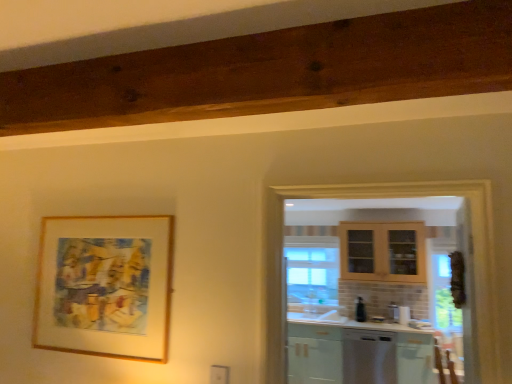
Question: Does black glossy soap dispenser at center have a lesser height compared to wooden frame at upper left?

Choices:
 (A) yes
 (B) no

Answer: (A)

Question: From the image's perspective, is black glossy soap dispenser at center over wooden frame at upper left?

Choices:
 (A) yes
 (B) no

Answer: (B)

Question: Is black glossy soap dispenser at center far away from wooden frame at upper left?

Choices:
 (A) yes
 (B) no

Answer: (A)

Question: From a real-world perspective, is black glossy soap dispenser at center under wooden frame at upper left?

Choices:
 (A) yes
 (B) no

Answer: (A)

Question: Is black glossy soap dispenser at center behind wooden frame at upper left?

Choices:
 (A) no
 (B) yes

Answer: (B)

Question: From a real-world perspective, is black glossy soap dispenser at center above or below wooden frame at upper left?

Choices:
 (A) above
 (B) below

Answer: (B)

Question: Is black glossy soap dispenser at center bigger or smaller than wooden frame at upper left?

Choices:
 (A) small
 (B) big

Answer: (A)

Question: From the image's perspective, is black glossy soap dispenser at center above or below wooden frame at upper left?

Choices:
 (A) below
 (B) above

Answer: (A)

Question: Would you say black glossy soap dispenser at center is inside or outside wooden frame at upper left?

Choices:
 (A) inside
 (B) outside

Answer: (B)

Question: Considering the positions of point coord(387,349) and point coord(354,311), is point coord(387,349) closer or farther from the camera than point coord(354,311)?

Choices:
 (A) closer
 (B) farther

Answer: (A)

Question: Is satin white dishwasher at lower right wider or thinner than black glossy soap dispenser at center?

Choices:
 (A) thin
 (B) wide

Answer: (B)

Question: Is satin white dishwasher at lower right inside the boundaries of black glossy soap dispenser at center, or outside?

Choices:
 (A) outside
 (B) inside

Answer: (A)

Question: From a real-world perspective, relative to black glossy soap dispenser at center, is satin white dishwasher at lower right vertically above or below?

Choices:
 (A) above
 (B) below

Answer: (B)

Question: Visually, is wooden frame at upper left positioned to the left or to the right of black glossy soap dispenser at center?

Choices:
 (A) left
 (B) right

Answer: (A)

Question: From the image's perspective, is wooden frame at upper left above or below black glossy soap dispenser at center?

Choices:
 (A) below
 (B) above

Answer: (B)